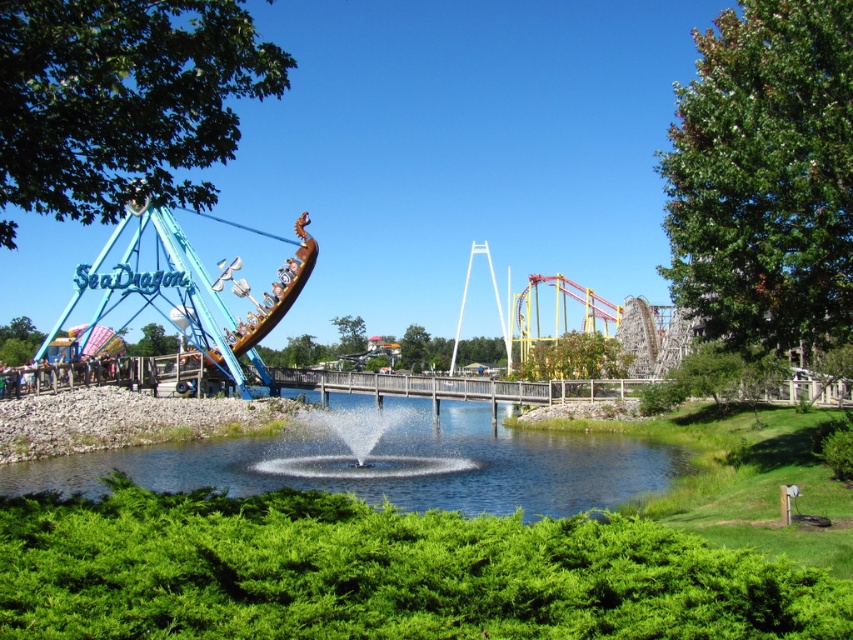
You are standing at the entrance of the amusement park and want to take a photo of the clear water at center. Where should you position yourself to capture it in the frame?

To capture the clear water at center in your photo, position yourself so that the camera is aimed at the coordinates point (389, 461) where the clear water at center is located.

You are designing a new path for visitors to walk around the clear water at center and the rusty metal boat at left. Considering their sizes, which area should the path prioritize to accommodate more visitors?

The path should prioritize the area around the rusty metal boat at left because it occupies more space than the clear water at center, allowing for wider pathways and more visitor capacity.